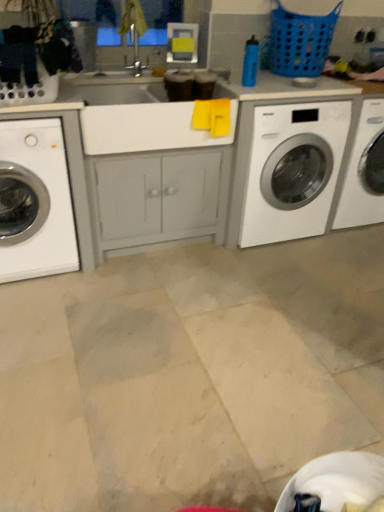
Question: Is white glossy washing machine at left, positioned as the second washing machine in right-to-left order, closer to camera compared to blue plastic laundry basket at upper right?

Choices:
 (A) yes
 (B) no

Answer: (A)

Question: Can you confirm if white glossy washing machine at left, which ranks as the 1th washing machine in left-to-right order, is wider than blue plastic laundry basket at upper right?

Choices:
 (A) no
 (B) yes

Answer: (B)

Question: Is white glossy washing machine at left, positioned as the second washing machine in right-to-left order, positioned with its back to blue plastic laundry basket at upper right?

Choices:
 (A) yes
 (B) no

Answer: (B)

Question: Is there a large distance between white glossy washing machine at left, positioned as the second washing machine in right-to-left order, and blue plastic laundry basket at upper right?

Choices:
 (A) no
 (B) yes

Answer: (B)

Question: Does white glossy washing machine at left, positioned as the second washing machine in right-to-left order, lie behind blue plastic laundry basket at upper right?

Choices:
 (A) no
 (B) yes

Answer: (A)

Question: Would you say white glossy washing machine at left, positioned as the second washing machine in right-to-left order, is outside blue plastic laundry basket at upper right?

Choices:
 (A) no
 (B) yes

Answer: (B)

Question: Does blue plastic laundry basket at upper right have a greater height compared to white glossy washing machine at left, which ranks as the 1th washing machine in left-to-right order?

Choices:
 (A) no
 (B) yes

Answer: (A)

Question: Does blue plastic laundry basket at upper right appear on the left side of white glossy washing machine at left, positioned as the second washing machine in right-to-left order?

Choices:
 (A) yes
 (B) no

Answer: (B)

Question: Is blue plastic laundry basket at upper right further to camera compared to white glossy washing machine at left, positioned as the second washing machine in right-to-left order?

Choices:
 (A) no
 (B) yes

Answer: (B)

Question: From a real-world perspective, is blue plastic laundry basket at upper right under white glossy washing machine at left, positioned as the second washing machine in right-to-left order?

Choices:
 (A) yes
 (B) no

Answer: (B)

Question: Considering the relative sizes of blue plastic laundry basket at upper right and white glossy washing machine at left, which ranks as the 1th washing machine in left-to-right order, in the image provided, is blue plastic laundry basket at upper right bigger than white glossy washing machine at left, which ranks as the 1th washing machine in left-to-right order,?

Choices:
 (A) yes
 (B) no

Answer: (B)

Question: Considering the relative positions of blue plastic laundry basket at upper right and white glossy washing machine at left, which ranks as the 1th washing machine in left-to-right order, in the image provided, is blue plastic laundry basket at upper right in front of white glossy washing machine at left, which ranks as the 1th washing machine in left-to-right order,?

Choices:
 (A) no
 (B) yes

Answer: (A)

Question: Would you say blue plastic laundry basket at upper right is part of white glossy washing machine at center right, which is counted as the first washing machine, starting from the right,'s contents?

Choices:
 (A) yes
 (B) no

Answer: (B)